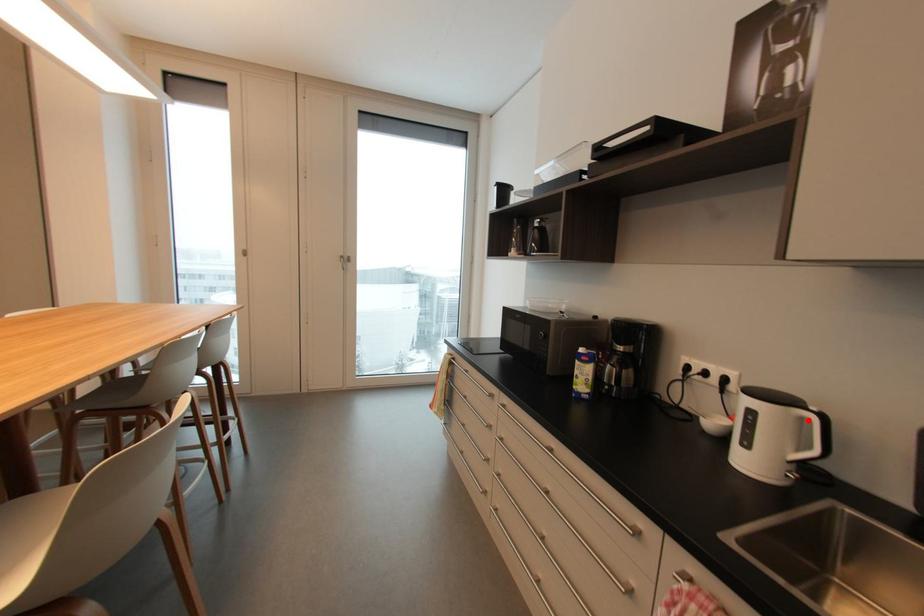
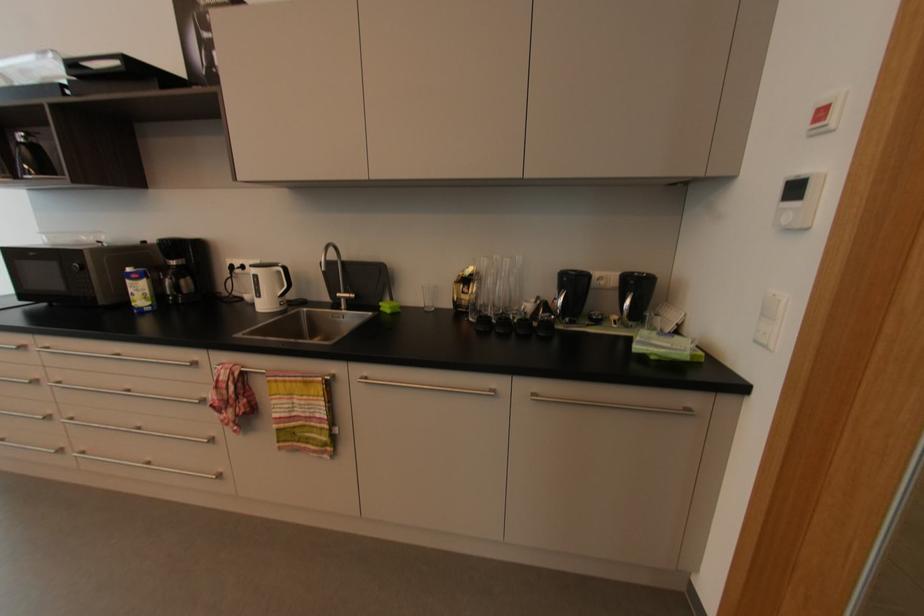
Locate, in the second image, the point that corresponds to the highlighted location in the first image.

(282, 273)